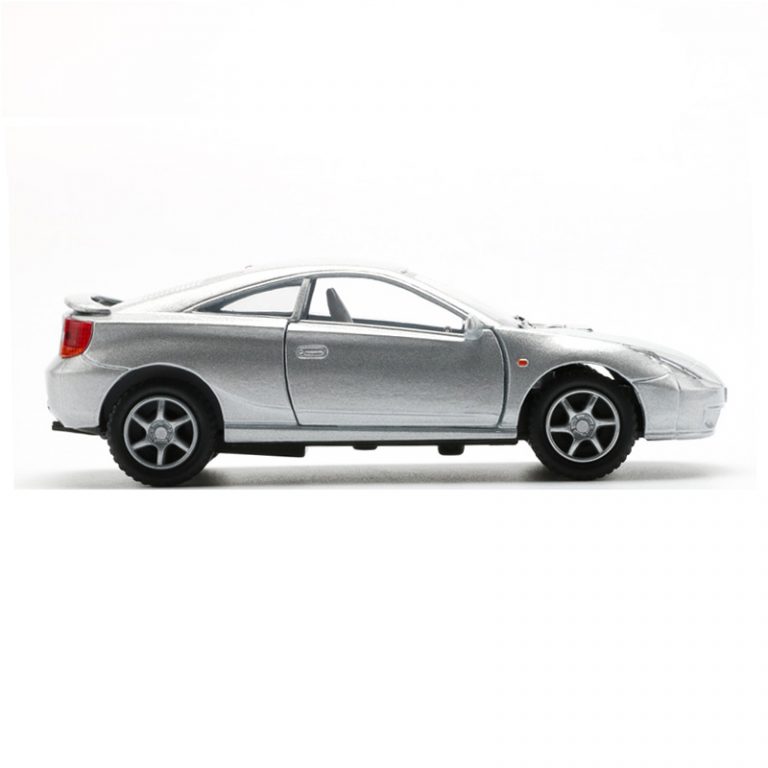
Where is `seat back`? This screenshot has width=768, height=768. seat back is located at coordinates (335, 299).